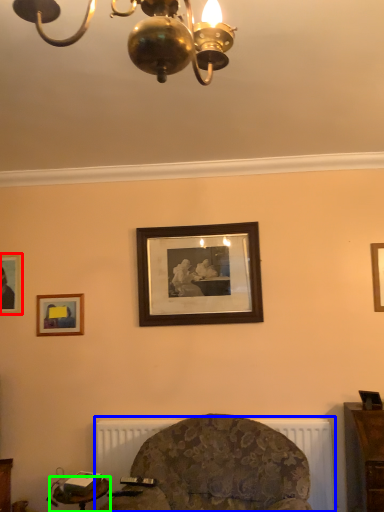
Question: Considering the real-world distances, which object is closest to picture frame (highlighted by a red box)? radiator (highlighted by a blue box) or table (highlighted by a green box).

Choices:
 (A) radiator
 (B) table

Answer: (B)